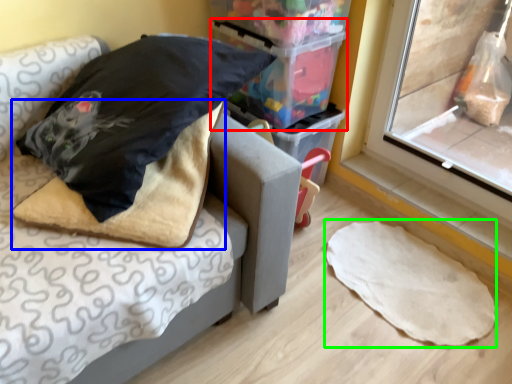
Question: Based on their relative distances, which object is farther from storage box (highlighted by a red box)? Choose from blanket (highlighted by a blue box) and linen (highlighted by a green box).

Choices:
 (A) blanket
 (B) linen

Answer: (B)